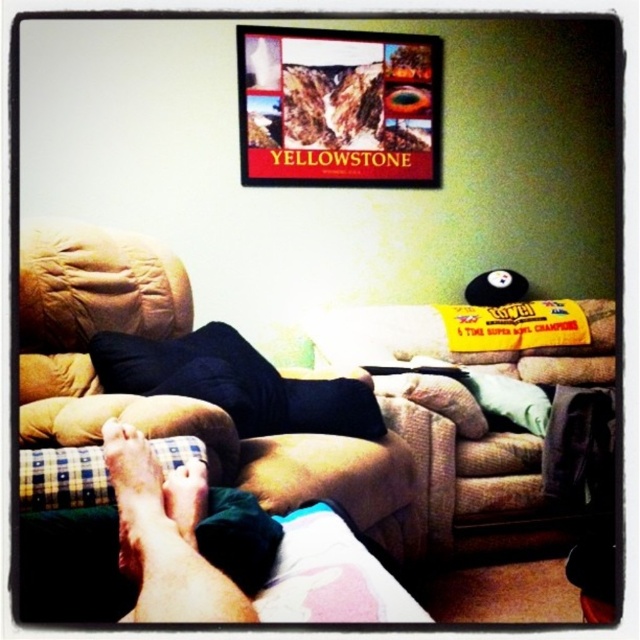
You are a photographer setting up a shoot in this living room. You need to position a small lamp between the brown fabric armchair at lower left and the smooth skin foot at lower left. Based on their positions, which object should the lamp be placed closer to?

The lamp should be placed closer to the smooth skin foot at lower left because the brown fabric armchair at lower left is to the left of the smooth skin foot at lower left, meaning the foot is positioned further to the right compared to the armchair.

You are standing in the living room and want to place a small plant between the two points, point 1 at (x=61, y=387) and point 2 at (x=198, y=472). Since you want the plant to be closer to the front of the room, which point should you place it near?

Point 2 at (x=198, y=472) is closer to the front of the room because point 1 at (x=61, y=387) is behind it.